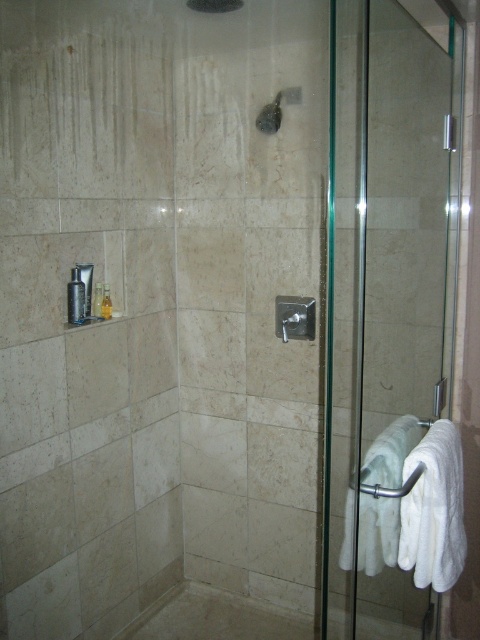
Question: Which point appears farthest from the camera in this image?

Choices:
 (A) (277, 125)
 (B) (348, 129)

Answer: (A)

Question: Which is nearer to the beige marble bath at lower center?

Choices:
 (A) transparent glass door at right
 (B) matte black soap dispenser at upper center

Answer: (A)

Question: Where is transparent glass door at right located in relation to matte black soap dispenser at upper center in the image?

Choices:
 (A) right
 (B) left

Answer: (A)

Question: Is transparent glass door at right to the right of beige marble bath at lower center from the viewer's perspective?

Choices:
 (A) yes
 (B) no

Answer: (A)

Question: Among these points, which one is farthest from the camera?

Choices:
 (A) (267, 116)
 (B) (340, 326)

Answer: (A)

Question: Does transparent glass door at right lie in front of matte black soap dispenser at upper center?

Choices:
 (A) no
 (B) yes

Answer: (B)